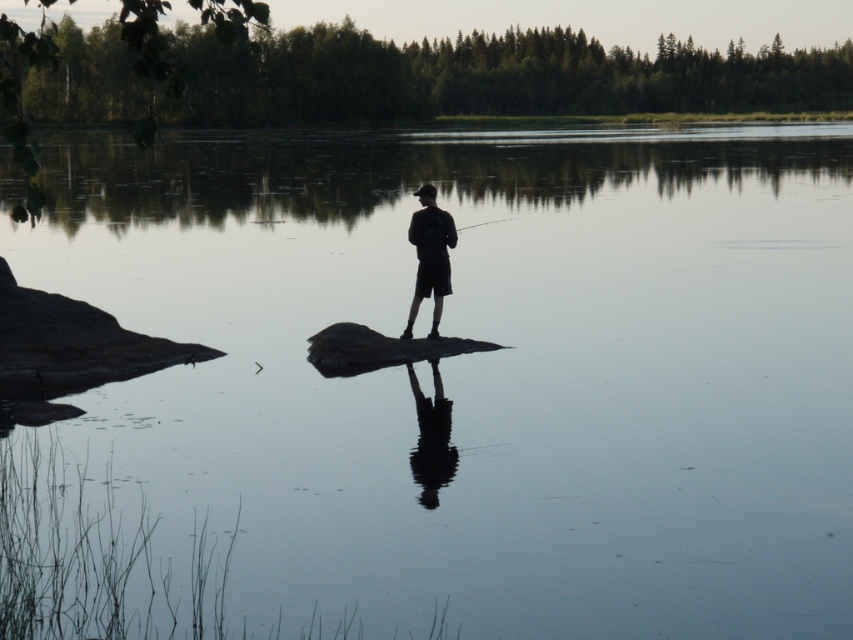
Can you confirm if black matte shorts at center is positioned to the right of smooth black rod at center?

In fact, black matte shorts at center is to the left of smooth black rod at center.

Between black matte shorts at center and smooth black rod at center, which one has more height?

black matte shorts at center is taller.

The width and height of the screenshot is (853, 640). In order to click on black matte shorts at center in this screenshot , I will do `click(430, 257)`.

Identify the location of black matte shorts at center. The width and height of the screenshot is (853, 640). (430, 257).